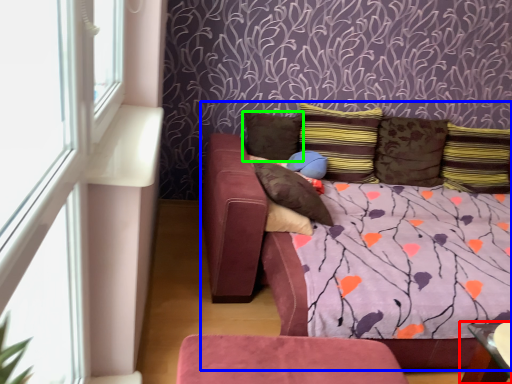
Question: Estimate the real-world distances between objects in this image. Which object is closer to table (highlighted by a red box), studio couch (highlighted by a blue box) or pillow (highlighted by a green box)?

Choices:
 (A) studio couch
 (B) pillow

Answer: (A)